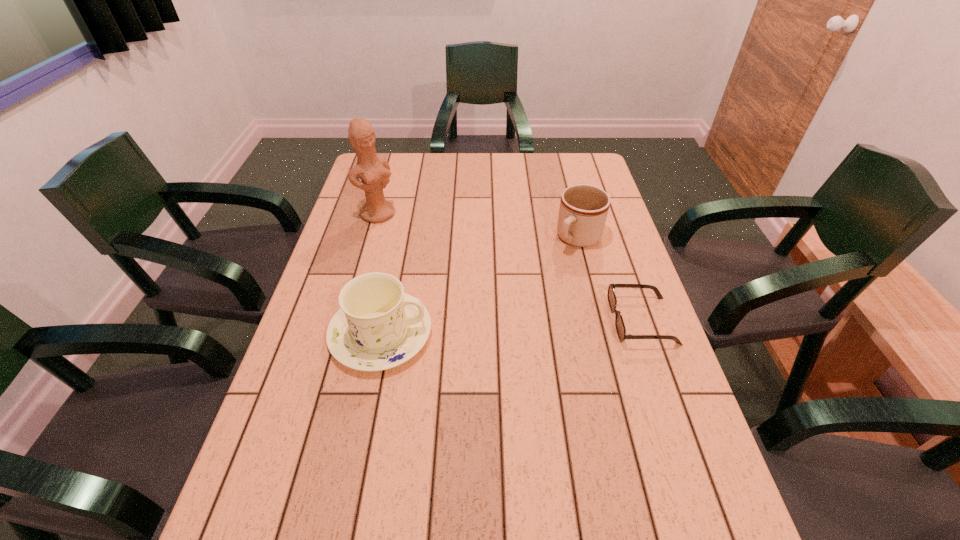
This screenshot has width=960, height=540. Identify the location of chinaware. (378, 326).

Where is `the shortest object`? The image size is (960, 540). the shortest object is located at coordinates (619, 323).

The image size is (960, 540). I want to click on mug, so click(583, 210).

Identify the location of the tallest object. The image size is (960, 540). (374, 172).

Image resolution: width=960 pixels, height=540 pixels. Find the location of `vacant space located 0.330m on the handle side of the chinaware`. vacant space located 0.330m on the handle side of the chinaware is located at coordinates (564, 334).

Identify the location of vacant space located on the front-facing side of the shortest object. [490, 321].

Find the location of a particular element. free space located on the front-facing side of the shortest object is located at coordinates (478, 321).

Where is `free spot located on the front-facing side of the shortest object`? free spot located on the front-facing side of the shortest object is located at coordinates (509, 321).

At what (x,y) coordinates should I click in order to perform the action: click on free space located 0.270m on the side of the mug with the handle. Please return your answer as a coordinate pair (x, y). Looking at the image, I should click on (516, 305).

Image resolution: width=960 pixels, height=540 pixels. What are the coordinates of `free region located 0.110m on the side of the mug with the handle` in the screenshot? It's located at (547, 272).